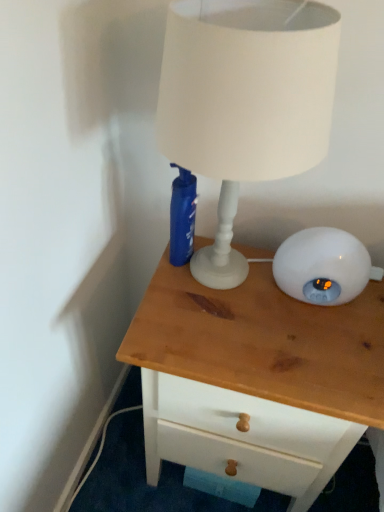
Find the location of a particular element. The image size is (384, 512). free point below white matte lampshade at upper center (from a real-world perspective) is located at coordinates (215, 283).